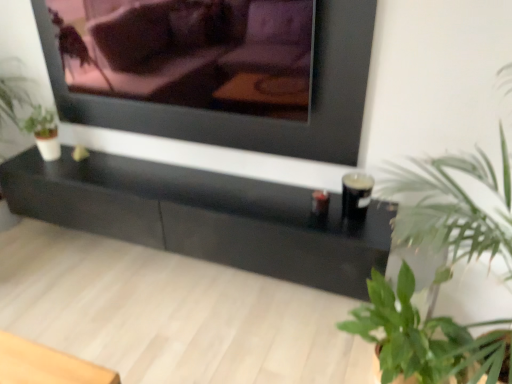
Identify the location of vacant area situated below matte black frame at upper center (from a real-world perspective). (185, 164).